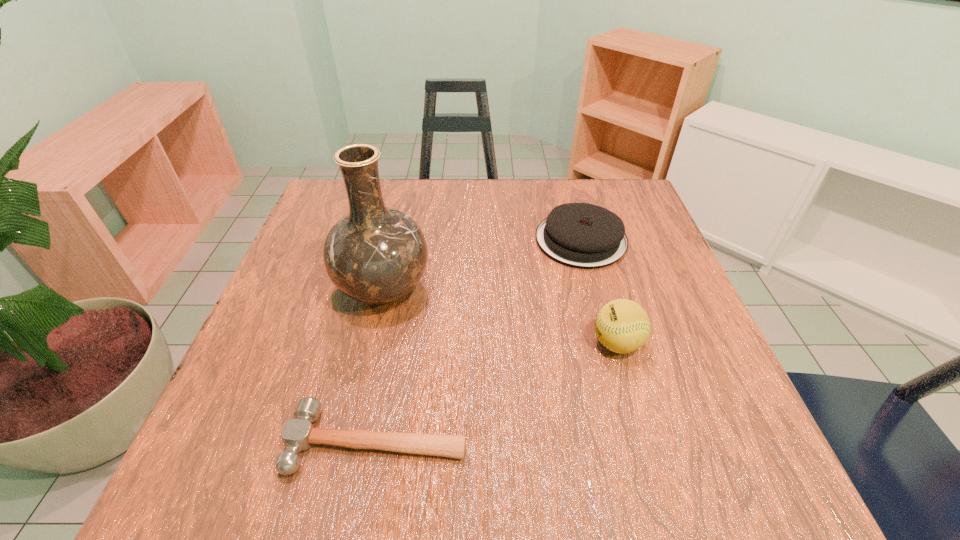
This screenshot has height=540, width=960. Find the location of `vacant area situated 0.240m on the back of the shortest object`. vacant area situated 0.240m on the back of the shortest object is located at coordinates (402, 302).

This screenshot has width=960, height=540. What are the coordinates of `object that is at the far edge` in the screenshot? It's located at pyautogui.click(x=581, y=235).

Locate an element on the screen. This screenshot has height=540, width=960. object at the near edge is located at coordinates (298, 434).

Find the location of a particular element. vase positioned at the left edge is located at coordinates (375, 254).

Locate an element on the screen. The height and width of the screenshot is (540, 960). hammer at the left edge is located at coordinates (298, 434).

In order to click on softball positioned at the right edge in this screenshot , I will do `click(622, 326)`.

Where is `pancake at the right edge`? pancake at the right edge is located at coordinates (581, 235).

You are a GUI agent. You are given a task and a screenshot of the screen. Output one action in this format:
    pyautogui.click(x=<x>, y=<y>)
    Task: Click on the object positioned at the near left corner
    This screenshot has height=540, width=960.
    Given the screenshot: What is the action you would take?
    pyautogui.click(x=298, y=434)

I want to click on object that is at the far right corner, so tap(581, 235).

Find the location of a particular element. This screenshot has width=960, height=540. free space at the far edge of the desktop is located at coordinates (x=492, y=204).